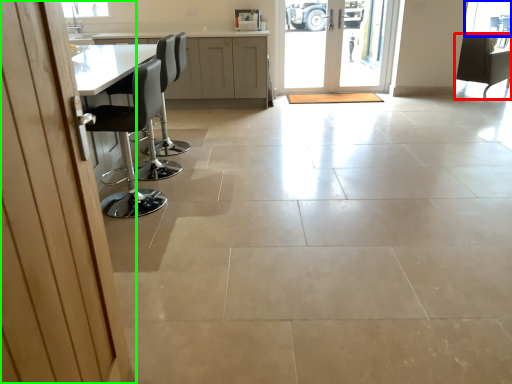
Question: Based on their relative distances, which object is farther from chair (highlighted by a red box)? Choose from window screen (highlighted by a blue box) and door (highlighted by a green box).

Choices:
 (A) window screen
 (B) door

Answer: (B)